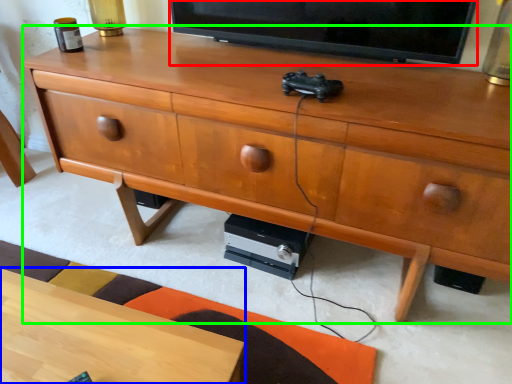
Question: Which object is positioned farthest from television (highlighted by a red box)? Select from desk (highlighted by a blue box) and chest of drawers (highlighted by a green box).

Choices:
 (A) desk
 (B) chest of drawers

Answer: (A)